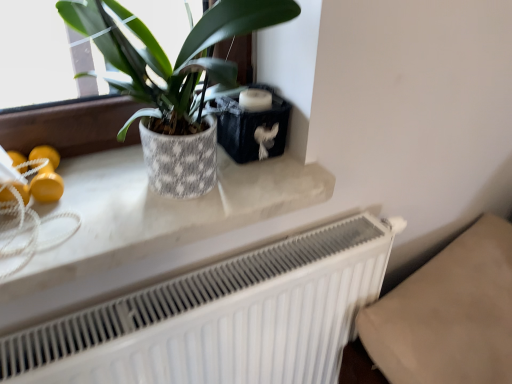
Question: Should I look upward or downward to see white marble counter top at upper center?

Choices:
 (A) down
 (B) up

Answer: (B)

Question: Is textured ceramic pot at upper left aimed at white marble counter top at upper center?

Choices:
 (A) yes
 (B) no

Answer: (B)

Question: Does textured ceramic pot at upper left appear on the right side of white marble counter top at upper center?

Choices:
 (A) no
 (B) yes

Answer: (B)

Question: Can you confirm if textured ceramic pot at upper left is positioned to the left of white marble counter top at upper center?

Choices:
 (A) no
 (B) yes

Answer: (A)

Question: Does textured ceramic pot at upper left contain white marble counter top at upper center?

Choices:
 (A) no
 (B) yes

Answer: (A)

Question: Can you confirm if textured ceramic pot at upper left is shorter than white marble counter top at upper center?

Choices:
 (A) no
 (B) yes

Answer: (A)

Question: Is the position of textured ceramic pot at upper left less distant than that of white marble counter top at upper center?

Choices:
 (A) yes
 (B) no

Answer: (A)

Question: Can you confirm if white marble counter top at upper center is taller than white matte radiator at lower center?

Choices:
 (A) yes
 (B) no

Answer: (B)

Question: Considering the relative sizes of white marble counter top at upper center and white matte radiator at lower center in the image provided, is white marble counter top at upper center smaller than white matte radiator at lower center?

Choices:
 (A) no
 (B) yes

Answer: (B)

Question: Does white marble counter top at upper center have a lesser height compared to white matte radiator at lower center?

Choices:
 (A) yes
 (B) no

Answer: (A)

Question: Considering the relative positions of white marble counter top at upper center and white matte radiator at lower center in the image provided, is white marble counter top at upper center behind white matte radiator at lower center?

Choices:
 (A) no
 (B) yes

Answer: (A)

Question: Can you confirm if white marble counter top at upper center is positioned to the left of white matte radiator at lower center?

Choices:
 (A) no
 (B) yes

Answer: (B)

Question: From a real-world perspective, does white marble counter top at upper center sit lower than white matte radiator at lower center?

Choices:
 (A) yes
 (B) no

Answer: (B)

Question: Can you confirm if white matte radiator at lower center is smaller than textured ceramic pot at upper left?

Choices:
 (A) yes
 (B) no

Answer: (B)